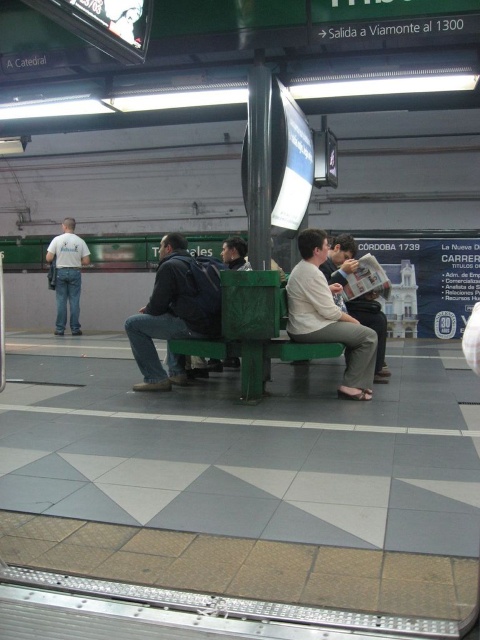
Is light beige fabric shirt at center to the right of light brown leather jacket at center from the viewer's perspective?

No, light beige fabric shirt at center is not to the right of light brown leather jacket at center.

This screenshot has width=480, height=640. Identify the location of light beige fabric shirt at center. (x=327, y=316).

Does dark blue jeans at center have a lesser width compared to light brown leather jacket at center?

No, dark blue jeans at center is not thinner than light brown leather jacket at center.

Who is more forward, (216, 324) or (377, 333)?

Point (216, 324) is in front.

Locate an element on the screen. Image resolution: width=480 pixels, height=640 pixels. dark blue jeans at center is located at coordinates (173, 312).

Is light beige fabric shirt at center smaller than light blue jeans at left?

No.

Between point (344, 321) and point (67, 227), which one is positioned in front?

Point (344, 321)

Find the location of `light beige fabric shirt at center`. light beige fabric shirt at center is located at coordinates (327, 316).